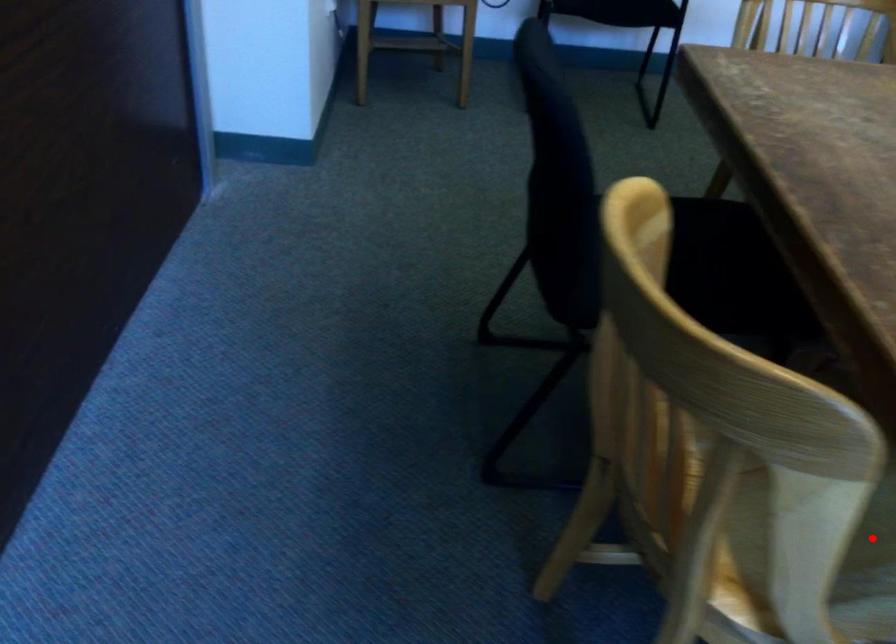
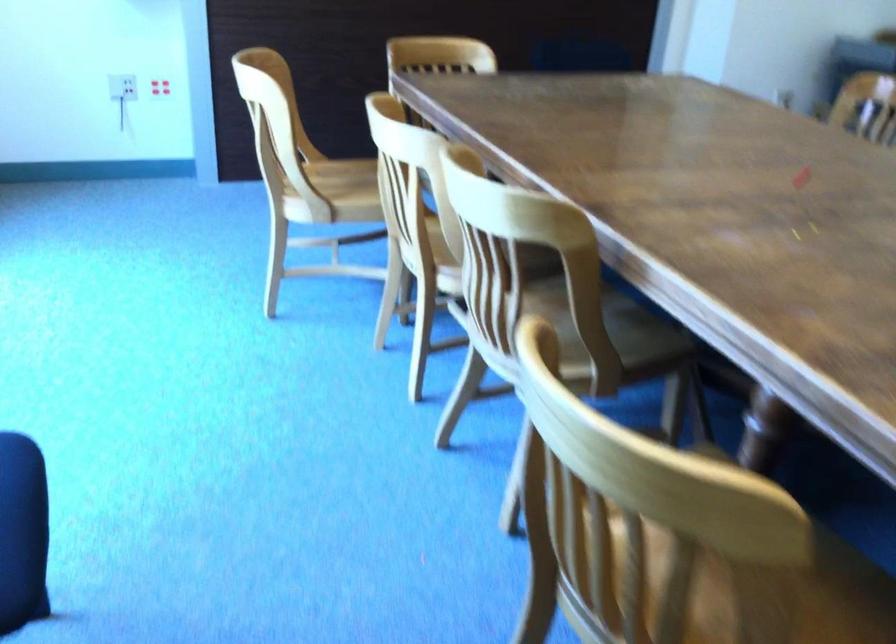
Question: I am providing you with two images of the same scene from different viewpoints. A red point is marked on the first image. Is the red point's position out of view in image 2?

Choices:
 (A) Yes
 (B) No

Answer: (A)